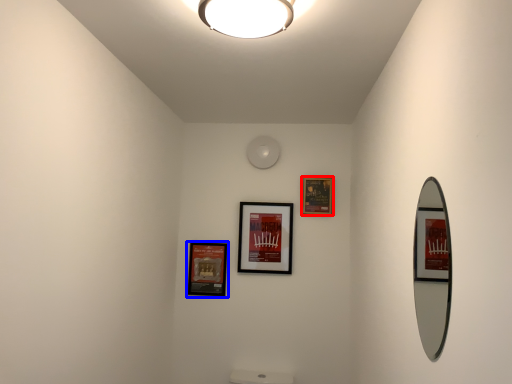
Question: Which point is further to the camera, picture frame (highlighted by a red box) or picture frame (highlighted by a blue box)?

Choices:
 (A) picture frame
 (B) picture frame

Answer: (B)